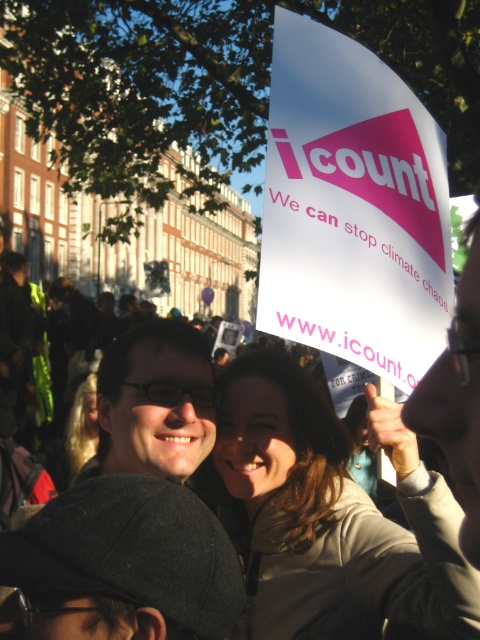
Question: Which point appears farthest from the camera in this image?

Choices:
 (A) (468, 628)
 (B) (156, 378)
 (C) (81, 420)

Answer: (C)

Question: Which object appears closest to the camera in this image?

Choices:
 (A) matte beige coat at center
 (B) matte black glasses at center

Answer: (B)

Question: Can you confirm if matte beige coat at center is bigger than blonde hair at lower left?

Choices:
 (A) yes
 (B) no

Answer: (A)

Question: From the image, what is the correct spatial relationship of matte beige coat at center in relation to blonde hair at lower left?

Choices:
 (A) left
 (B) right

Answer: (B)

Question: Is matte beige coat at center further to camera compared to matte black glasses at center?

Choices:
 (A) yes
 (B) no

Answer: (A)

Question: Among these points, which one is nearest to the camera?

Choices:
 (A) (419, 579)
 (B) (75, 467)

Answer: (A)